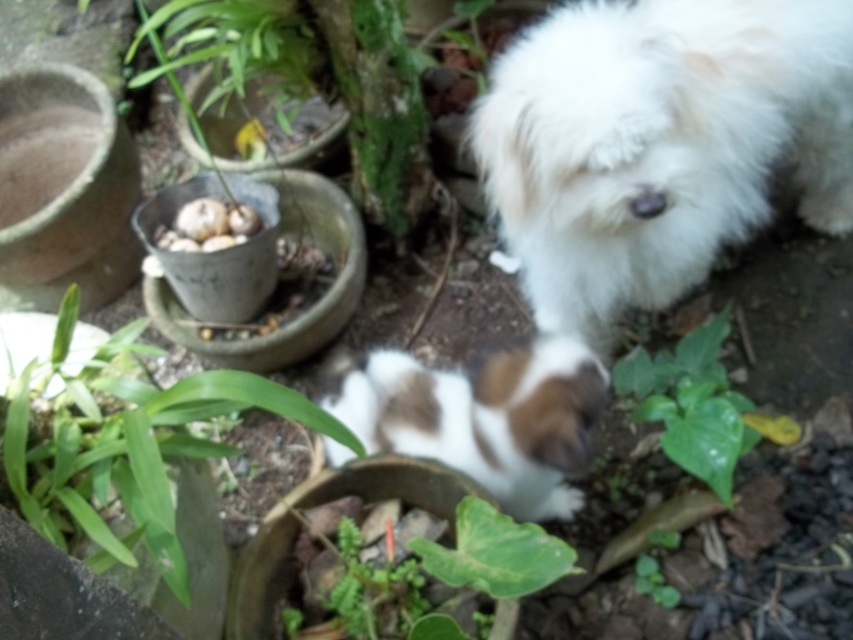
You are holding a 4 feet long leash. You see the brown and white fur at center. Can you safely reach it without extending the leash beyond its length?

The brown and white fur at center is 3.98 feet from viewer, so yes, the leash can safely reach it as the distance is within the leash length.

You are a gardener who wants to place a new small statue between the green leafy plant at lower left and the green leafy plant at lower center. Which plant should you use as the reference point to ensure the statue fits between them?

The green leafy plant at lower left has a larger width than the green leafy plant at lower center. To ensure the statue fits between them, you should use the green leafy plant at lower left as the reference point since it occupies more space, allowing for proper placement between the two plants.

You are a gardener who wants to water the green leafy plant at lower left and the green leafy plant at lower center. Which plant should you water first if you start from the left side of the garden?

The green leafy plant at lower left should be watered first since it is positioned on the left side of the green leafy plant at lower center.